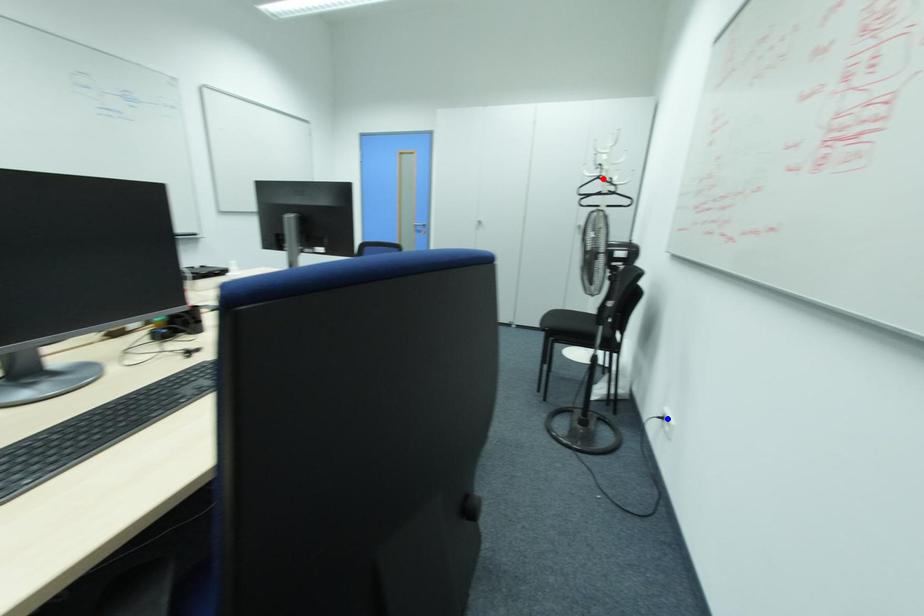
Question: Which of the two points in the image is closer to the camera?

Choices:
 (A) Blue point is closer.
 (B) Red point is closer.

Answer: (A)